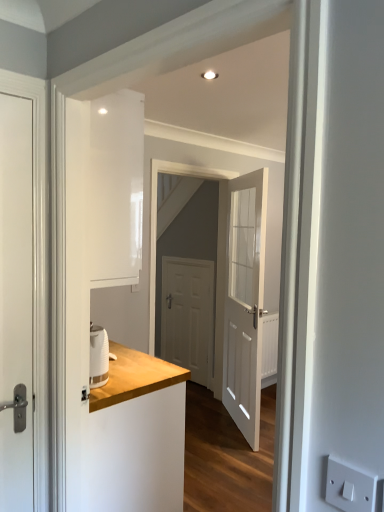
The width and height of the screenshot is (384, 512). Find the location of `white matte door at left, which is the first door from left to right`. white matte door at left, which is the first door from left to right is located at coordinates (16, 303).

What do you see at coordinates (245, 301) in the screenshot? I see `white wooden door at center, which ranks as the 2th door in back-to-front order` at bounding box center [245, 301].

I want to click on white matte door at left, which ranks as the 3th door in back-to-front order, so click(16, 303).

Is point (328, 463) positioned behind point (153, 457)?

That is False.

Which of these two, white plastic electric outlet at lower right or wooden counter at left, stands shorter?

Standing shorter between the two is white plastic electric outlet at lower right.

Considering the sizes of objects white plastic electric outlet at lower right and wooden counter at left in the image provided, who is wider, white plastic electric outlet at lower right or wooden counter at left?

Wider between the two is wooden counter at left.

From a real-world perspective, between white plastic electric outlet at lower right and wooden counter at left, who is vertically higher?

In real-world perspective, white plastic electric outlet at lower right is above.

Considering the relative sizes of wooden counter at left and white wooden door at center, positioned as the second door in front-to-back order, in the image provided, is wooden counter at left wider than white wooden door at center, positioned as the second door in front-to-back order,?

Yes, wooden counter at left is wider than white wooden door at center, positioned as the second door in front-to-back order.

I want to click on counter lying on the left of white wooden door at center, which ranks as the 2th door in back-to-front order, so click(x=136, y=436).

Looking at this image, are wooden counter at left and white wooden door at center, positioned as the second door in front-to-back order, located far from each other?

Yes, wooden counter at left and white wooden door at center, positioned as the second door in front-to-back order, are located far from each other.

From the image's perspective, which one is positioned higher, wooden counter at left or white wooden door at center, which is the 3th door in left-to-right order?

white wooden door at center, which is the 3th door in left-to-right order, is shown above in the image.

Is wooden counter at left in contact with white plastic electric outlet at lower right?

No, wooden counter at left is not next to white plastic electric outlet at lower right.

Which is in front, point (105, 415) or point (329, 467)?

Positioned in front is point (329, 467).

From the picture: Is white plastic electric outlet at lower right at the back of wooden counter at left?

No, wooden counter at left is not facing away from white plastic electric outlet at lower right.

Which object is more forward, wooden counter at left or white matte door at left, which ranks as the 1th door in front-to-back order?

white matte door at left, which ranks as the 1th door in front-to-back order, is in front.

Choose the correct answer: Is wooden counter at left inside white matte door at left, which ranks as the 1th door in front-to-back order, or outside it?

wooden counter at left is located beyond the bounds of white matte door at left, which ranks as the 1th door in front-to-back order.

From a real-world perspective, is wooden counter at left beneath white matte door at left, the 3th door from the right?

Yes, from a real-world perspective, wooden counter at left is under white matte door at left, the 3th door from the right.

In terms of size, does wooden counter at left appear bigger or smaller than white matte door at left, the 3th door from the right?

wooden counter at left is bigger than white matte door at left, the 3th door from the right.

Between white wooden door at center, which ranks as the 1th door in right-to-left order, and wooden counter at left, which one has larger width?

wooden counter at left.

From the picture: From a real-world perspective, is white wooden door at center, which is the 3th door in left-to-right order, under wooden counter at left?

Actually, white wooden door at center, which is the 3th door in left-to-right order, is physically above wooden counter at left in the real world.

Is white wooden door at center, which ranks as the 1th door in right-to-left order, bigger than wooden counter at left?

No, white wooden door at center, which ranks as the 1th door in right-to-left order, is not bigger than wooden counter at left.

Is white wooden door at center, which ranks as the 2th door in back-to-front order, positioned behind wooden counter at left?

That is True.

Are white matte door at left, which is the first door from left to right, and wooden counter at left making contact?

white matte door at left, which is the first door from left to right, and wooden counter at left are clearly separated.

Based on the photo, in the image, is white matte door at left, which is the first door from left to right, positioned in front of or behind wooden counter at left?

white matte door at left, which is the first door from left to right, is positioned closer to the viewer than wooden counter at left.

Consider the image. Considering the sizes of objects white matte door at left, which ranks as the 3th door in back-to-front order, and wooden counter at left in the image provided, who is shorter, white matte door at left, which ranks as the 3th door in back-to-front order, or wooden counter at left?

With less height is wooden counter at left.

Does point (17, 480) appear closer or farther from the camera than point (110, 409)?

Point (17, 480) appears to be closer to the viewer than point (110, 409).

From the image's perspective, is white matte door at center, positioned as the second door in right-to-left order, located above white matte door at left, which ranks as the 3th door in back-to-front order?

No, from the image's perspective, white matte door at center, positioned as the second door in right-to-left order, is not on top of white matte door at left, which ranks as the 3th door in back-to-front order.

Starting from the white matte door at center, positioned as the second door in right-to-left order, which door is the 2nd one in front? Please provide its 2D coordinates.

[(16, 303)]

Between white matte door at center, which is the second door in left-to-right order, and white matte door at left, which ranks as the 3th door in back-to-front order, which one has smaller width?

white matte door at center, which is the second door in left-to-right order, is thinner.

Based on the photo, who is taller, white matte door at center, placed as the 1th door when sorted from back to front, or white matte door at left, the 3th door from the right?

white matte door at left, the 3th door from the right, is taller.

Find the location of a particular element. electric outlet that is above the wooden counter at left (from a real-world perspective) is located at coordinates (349, 487).

From the image's perspective, which door is the 2nd one above the wooden counter at left? Please provide its 2D coordinates.

[(245, 301)]

From the image, which object appears to be nearer to white plastic electric outlet at lower right, white wooden door at center, which is the 3th door in left-to-right order, or white matte door at center, placed as the 1th door when sorted from back to front?

Among the two, white wooden door at center, which is the 3th door in left-to-right order, is located nearer to white plastic electric outlet at lower right.

Which object lies further to the anchor point wooden counter at left, white wooden door at center, positioned as the second door in front-to-back order, or white matte door at left, which is the first door from left to right?

white wooden door at center, positioned as the second door in front-to-back order, is positioned further to the anchor wooden counter at left.

When comparing their distances from wooden counter at left, does white plastic electric outlet at lower right or white matte door at left, the 3th door from the right, seem closer?

white matte door at left, the 3th door from the right, is closer to wooden counter at left.

Considering their positions, is wooden counter at left positioned closer to white wooden door at center, positioned as the second door in front-to-back order, than white plastic electric outlet at lower right?

wooden counter at left.

Which object lies nearer to the anchor point wooden counter at left, white matte door at left, which is the first door from left to right, or white wooden door at center, which is the 3th door in left-to-right order?

The object closer to wooden counter at left is white matte door at left, which is the first door from left to right.

Estimate the real-world distances between objects in this image. Which object is further from white wooden door at center, which is the 3th door in left-to-right order, white plastic electric outlet at lower right or white matte door at left, the 3th door from the right?

white plastic electric outlet at lower right is positioned further to the anchor white wooden door at center, which is the 3th door in left-to-right order.

Looking at the image, which one is located further to white plastic electric outlet at lower right, wooden counter at left or white wooden door at center, which ranks as the 2th door in back-to-front order?

white wooden door at center, which ranks as the 2th door in back-to-front order.

Looking at this image, considering their positions, is white matte door at left, which ranks as the 3th door in back-to-front order, positioned further to white wooden door at center, which ranks as the 2th door in back-to-front order, than wooden counter at left?

white matte door at left, which ranks as the 3th door in back-to-front order, lies further to white wooden door at center, which ranks as the 2th door in back-to-front order, than the other object.

The image size is (384, 512). Find the location of `counter between white matte door at left, the 3th door from the right, and white plastic electric outlet at lower right from left to right`. counter between white matte door at left, the 3th door from the right, and white plastic electric outlet at lower right from left to right is located at coordinates (136, 436).

Identify the location of counter located between white plastic electric outlet at lower right and white wooden door at center, which is the 3th door in left-to-right order, in the depth direction. (136, 436).

The image size is (384, 512). What are the coordinates of `door between white plastic electric outlet at lower right and white wooden door at center, which is the 3th door in left-to-right order, from front to back` in the screenshot? It's located at (16, 303).

Locate an element on the screen. counter between white matte door at left, the 3th door from the right, and white matte door at center, positioned as the second door in right-to-left order, from front to back is located at coordinates (136, 436).